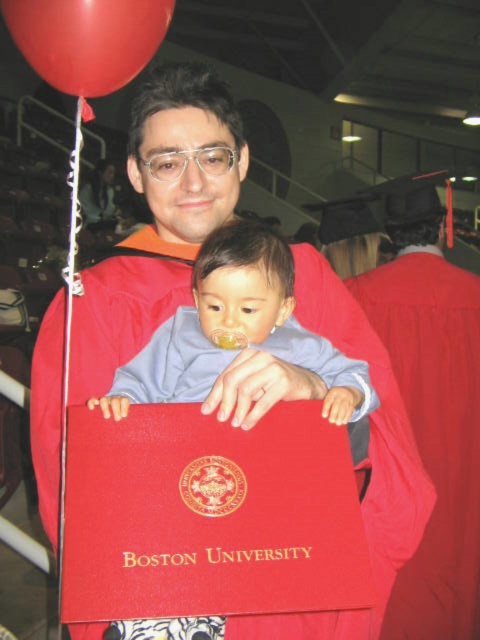
Who is more forward, (x=456, y=372) or (x=197, y=401)?

Point (x=197, y=401) is more forward.

Describe the element at coordinates (434, 432) in the screenshot. The image size is (480, 640). I see `red matte graduation gown at center` at that location.

Locate an element on the screen. The image size is (480, 640). red matte graduation gown at center is located at coordinates (434, 432).

Can you confirm if red matte graduation gown at center is taller than rubber balloon at upper left?

Indeed, red matte graduation gown at center has a greater height compared to rubber balloon at upper left.

Can you confirm if red matte graduation gown at center is positioned below rubber balloon at upper left?

Yes.

The width and height of the screenshot is (480, 640). What do you see at coordinates (434, 432) in the screenshot?
I see `red matte graduation gown at center` at bounding box center [434, 432].

Find the location of a particular element. The height and width of the screenshot is (640, 480). red matte graduation gown at center is located at coordinates (434, 432).

Does smooth blue shirt at center have a lesser width compared to rubber balloon at upper left?

In fact, smooth blue shirt at center might be wider than rubber balloon at upper left.

Does smooth blue shirt at center appear over rubber balloon at upper left?

Incorrect, smooth blue shirt at center is not positioned above rubber balloon at upper left.

Who is more forward, (180, 326) or (100, 68)?

Point (100, 68) is more forward.

Identify the location of smooth blue shirt at center. (237, 330).